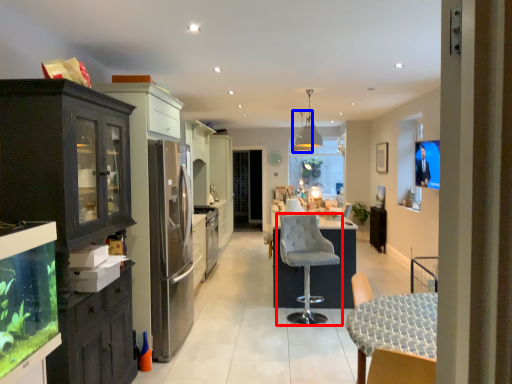
Question: Which object appears closest to the camera in this image, chair (highlighted by a red box) or lamp (highlighted by a blue box)?

Choices:
 (A) chair
 (B) lamp

Answer: (A)